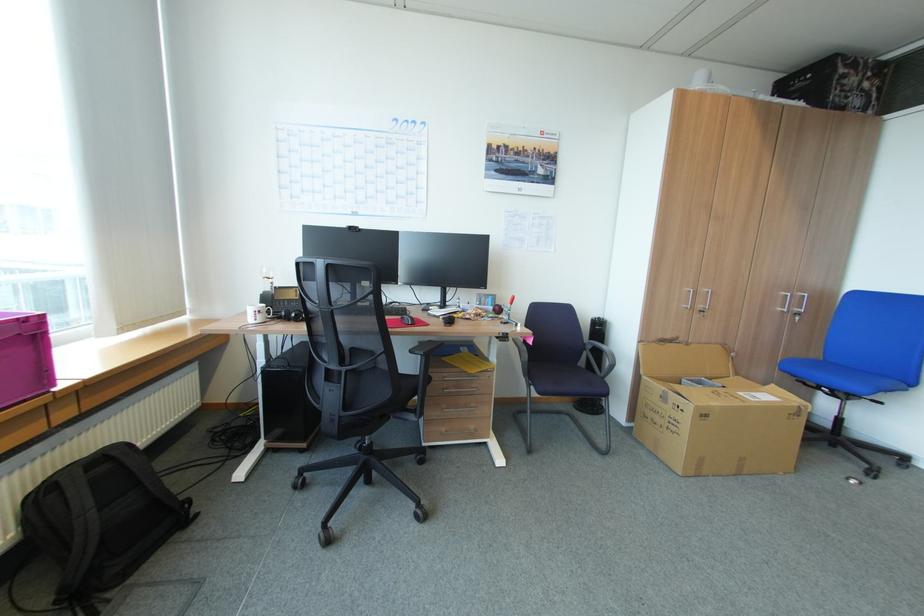
Where is `open cardboard box`? open cardboard box is located at coordinates (713, 414).